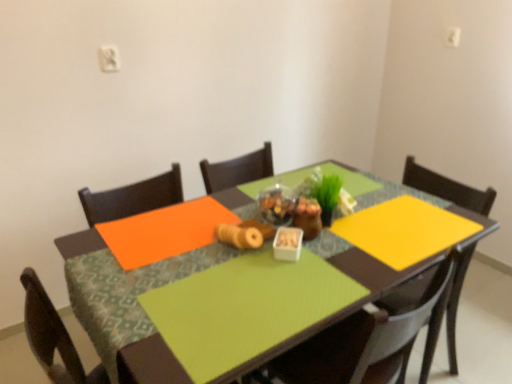
Locate an element on the screen. The image size is (512, 384). free region on the left part of white matte container at center is located at coordinates (228, 265).